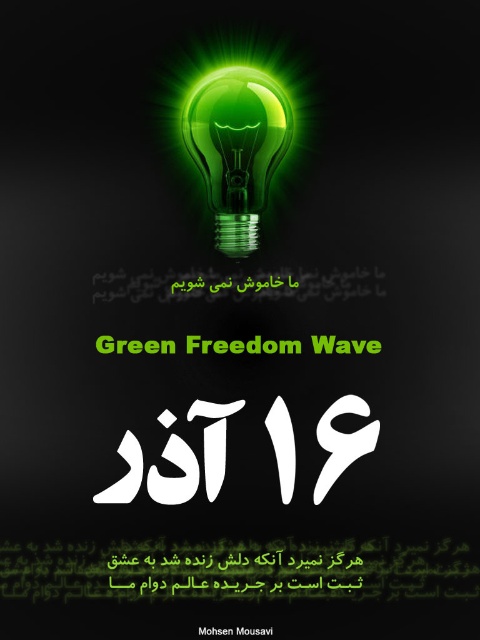
Question: Is the position of green glass bulb at center less distant than that of black matte text at lower center?

Choices:
 (A) no
 (B) yes

Answer: (B)

Question: Which is nearer to the green matte text at center?

Choices:
 (A) black paper at center
 (B) green glass bulb at center

Answer: (B)

Question: Does black matte text at lower center lie behind black paper at center?

Choices:
 (A) no
 (B) yes

Answer: (B)

Question: Is black matte text at lower center bigger than black paper at center?

Choices:
 (A) no
 (B) yes

Answer: (B)

Question: Which point is farther to the camera?

Choices:
 (A) green matte text at center
 (B) black matte text at lower center
 (C) black paper at center

Answer: (A)

Question: Considering the real-world distances, which object is farthest from the black paper at center?

Choices:
 (A) green glass bulb at center
 (B) black matte text at lower center
 (C) green matte text at center

Answer: (A)